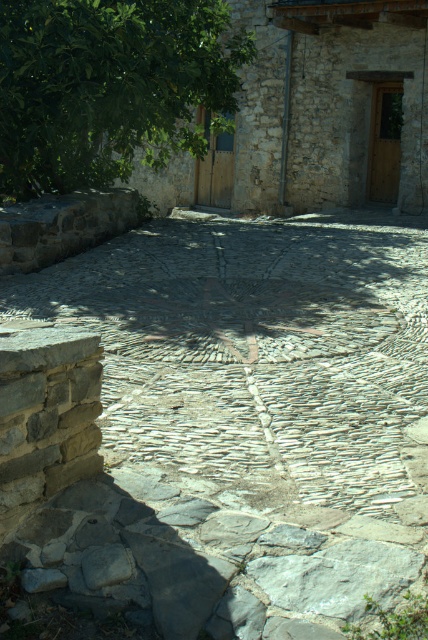
You are standing in the rustic stone courtyard and want to take a photo of the natural stone path at center and the green leafy tree at upper left. Which object is taller?

The natural stone path at center is much taller than the green leafy tree at upper left.

You are standing at the entrance of the rustic stone courtyard. You need to locate the natural stone path at center. According to the coordinates provided, where exactly should you look to find it?

The natural stone path at center is located at coordinates point (255,353).

You are standing in the rustic stone courtyard and want to walk towards the green leafy tree at upper left. Which direction should you head from the natural stone path at center?

The natural stone path at center is positioned under the green leafy tree at upper left, so you should head upward from the natural stone path at center to reach the green leafy tree at upper left.